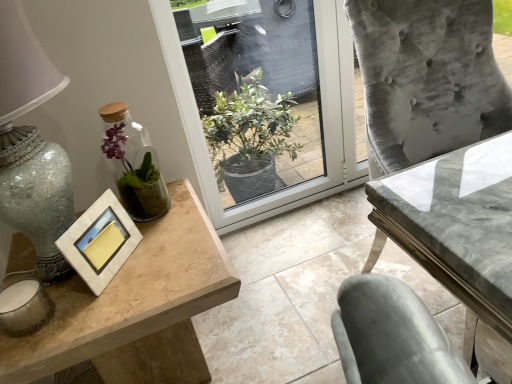
The image size is (512, 384). I want to click on free location in front of matte silver picture frame at left, so click(x=103, y=310).